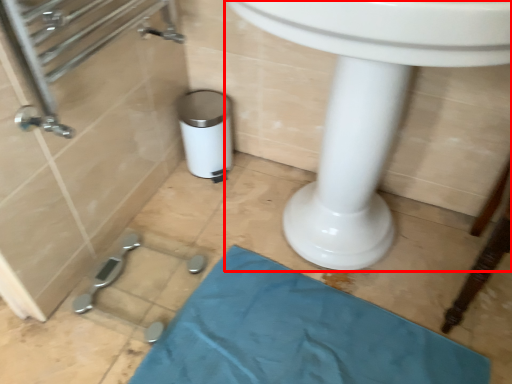
Question: From the image's perspective, where is sink (annotated by the red box) located relative to bath mat?

Choices:
 (A) below
 (B) above

Answer: (B)